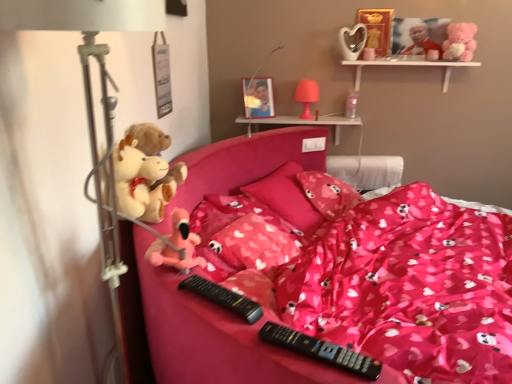
Find the location of a particular element. The width and height of the screenshot is (512, 384). vacant area that lies between pink plastic table lamp at upper center, the third table lamp positioned from the front, and metallic photo frame at upper center is located at coordinates (279, 121).